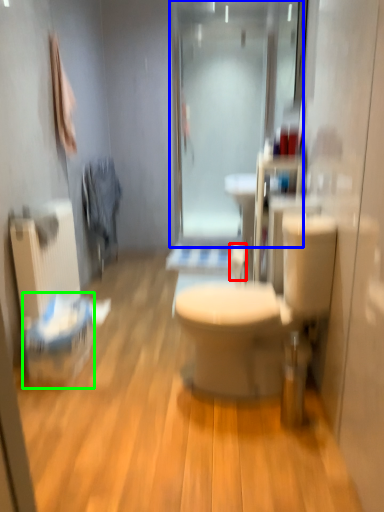
Question: Which is nearer to the toilet paper (highlighted by a red box)? shower door (highlighted by a blue box) or laundry basket (highlighted by a green box).

Choices:
 (A) shower door
 (B) laundry basket

Answer: (B)